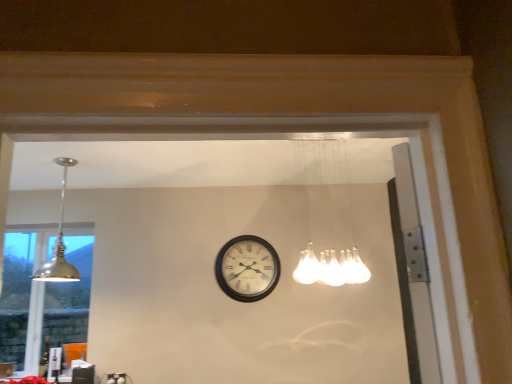
You are a GUI agent. You are given a task and a screenshot of the screen. Output one action in this format:
    pyautogui.click(x=<x>, y=<y>)
    Task: Click on the matte silver pendant light at upper left, placed as the second lamp when sorted from right to left
    The image size is (512, 384).
    Given the screenshot: What is the action you would take?
    pyautogui.click(x=59, y=243)

What do you see at coordinates (328, 214) in the screenshot? Image resolution: width=512 pixels, height=384 pixels. I see `white frosted glass light fixture at upper center, which appears as the 2th lamp when viewed from the left` at bounding box center [328, 214].

What is the approximate width of matte silver lampshade at left?

It is 3.69 inches.

What do you see at coordinates (247, 268) in the screenshot?
I see `black wooden clock at center` at bounding box center [247, 268].

Find the location of a particular element. matte silver pendant light at upper left, placed as the second lamp when sorted from right to left is located at coordinates [x=59, y=243].

From the image's perspective, is black wooden clock at center beneath matte silver lampshade at left?

No, from the image's perspective, black wooden clock at center is not below matte silver lampshade at left.

Would you say black wooden clock at center is to the left or to the right of matte silver lampshade at left in the picture?

From the image, it's evident that black wooden clock at center is to the right of matte silver lampshade at left.

Which of these two, black wooden clock at center or matte silver lampshade at left, is thinner?

matte silver lampshade at left is thinner.

In the scene shown: Is black wooden clock at center not close to matte silver lampshade at left?

Yes, black wooden clock at center and matte silver lampshade at left are quite far apart.

Is matte silver pendant light at upper left, the 1th lamp viewed from the left, completely or partially outside of black wooden clock at center?

matte silver pendant light at upper left, the 1th lamp viewed from the left, is positioned outside black wooden clock at center.

Does matte silver pendant light at upper left, placed as the second lamp when sorted from right to left, appear on the left side of black wooden clock at center?

Yes.

Can you tell me how much matte silver pendant light at upper left, placed as the second lamp when sorted from right to left, and black wooden clock at center differ in facing direction?

The angle between the facing direction of matte silver pendant light at upper left, placed as the second lamp when sorted from right to left, and the facing direction of black wooden clock at center is 90.3 degrees.

Are matte silver pendant light at upper left, placed as the second lamp when sorted from right to left, and black wooden clock at center making contact?

There is a gap between matte silver pendant light at upper left, placed as the second lamp when sorted from right to left, and black wooden clock at center.

Is black wooden clock at center thinner than matte silver pendant light at upper left, the 1th lamp viewed from the left?

Yes.

Can you confirm if black wooden clock at center is shorter than matte silver pendant light at upper left, placed as the second lamp when sorted from right to left?

Yes, black wooden clock at center is shorter than matte silver pendant light at upper left, placed as the second lamp when sorted from right to left.

Does black wooden clock at center turn towards matte silver pendant light at upper left, placed as the second lamp when sorted from right to left?

No, black wooden clock at center is not turned towards matte silver pendant light at upper left, placed as the second lamp when sorted from right to left.

Between black wooden clock at center and matte silver pendant light at upper left, the 1th lamp viewed from the left, which one appears on the right side from the viewer's perspective?

From the viewer's perspective, black wooden clock at center appears more on the right side.

From the image's perspective, is black wooden clock at center under white frosted glass light fixture at upper center, which appears as the 2th lamp when viewed from the left?

Yes, from the image's perspective, black wooden clock at center is below white frosted glass light fixture at upper center, which appears as the 2th lamp when viewed from the left.

Based on the photo, how many degrees apart are the facing directions of black wooden clock at center and white frosted glass light fixture at upper center, arranged as the 1th lamp when viewed from the right?

They differ by 90.3 degrees in their facing directions.

Considering the relative positions of black wooden clock at center and white frosted glass light fixture at upper center, which appears as the 2th lamp when viewed from the left, in the image provided, is black wooden clock at center to the left or to the right of white frosted glass light fixture at upper center, which appears as the 2th lamp when viewed from the left,?

From the image, it's evident that black wooden clock at center is to the left of white frosted glass light fixture at upper center, which appears as the 2th lamp when viewed from the left.

Could white frosted glass light fixture at upper center, which appears as the 2th lamp when viewed from the left, be considered to be inside black wooden clock at center?

No, white frosted glass light fixture at upper center, which appears as the 2th lamp when viewed from the left, is not a part of black wooden clock at center.

Does matte silver pendant light at upper left, the 1th lamp viewed from the left, have a smaller size compared to matte silver lampshade at left?

No, matte silver pendant light at upper left, the 1th lamp viewed from the left, is not smaller than matte silver lampshade at left.

Is matte silver pendant light at upper left, the 1th lamp viewed from the left, not close to matte silver lampshade at left?

No, matte silver pendant light at upper left, the 1th lamp viewed from the left, is not far from matte silver lampshade at left.

From a real-world perspective, which is physically above, matte silver pendant light at upper left, the 1th lamp viewed from the left, or matte silver lampshade at left?

In real-world perspective, matte silver pendant light at upper left, the 1th lamp viewed from the left, is above.

From a real-world perspective, who is located lower, matte silver lampshade at left or matte silver pendant light at upper left, the 1th lamp viewed from the left?

matte silver lampshade at left is physically lower.

Does point (14, 328) appear closer or farther from the camera than point (63, 180)?

Point (14, 328).

Are matte silver lampshade at left and matte silver pendant light at upper left, the 1th lamp viewed from the left, beside each other?

No.

Can you confirm if matte silver lampshade at left is smaller than matte silver pendant light at upper left, the 1th lamp viewed from the left?

Yes, matte silver lampshade at left is smaller than matte silver pendant light at upper left, the 1th lamp viewed from the left.

Does point (329, 175) appear closer or farther from the camera than point (72, 162)?

Point (329, 175) appears to be farther away from the viewer than point (72, 162).

From the image's perspective, relative to matte silver pendant light at upper left, the 1th lamp viewed from the left, is white frosted glass light fixture at upper center, which appears as the 2th lamp when viewed from the left, above or below?

Clearly, from the image's perspective, white frosted glass light fixture at upper center, which appears as the 2th lamp when viewed from the left, is above matte silver pendant light at upper left, the 1th lamp viewed from the left.

Is white frosted glass light fixture at upper center, which appears as the 2th lamp when viewed from the left, to the left or to the right of matte silver pendant light at upper left, placed as the second lamp when sorted from right to left, in the image?

white frosted glass light fixture at upper center, which appears as the 2th lamp when viewed from the left, is positioned on matte silver pendant light at upper left, placed as the second lamp when sorted from right to left,'s right side.

Does white frosted glass light fixture at upper center, which appears as the 2th lamp when viewed from the left, have a smaller size compared to matte silver pendant light at upper left, the 1th lamp viewed from the left?

Actually, white frosted glass light fixture at upper center, which appears as the 2th lamp when viewed from the left, might be larger than matte silver pendant light at upper left, the 1th lamp viewed from the left.

The width and height of the screenshot is (512, 384). What are the coordinates of `window below the black wooden clock at center (from a real-world perspective)` in the screenshot? It's located at (42, 294).

Image resolution: width=512 pixels, height=384 pixels. What are the coordinates of `wall clock below the matte silver pendant light at upper left, the 1th lamp viewed from the left (from the image's perspective)` in the screenshot? It's located at (247, 268).

Estimate the real-world distances between objects in this image. Which object is further from black wooden clock at center, matte silver lampshade at left or white frosted glass light fixture at upper center, arranged as the 1th lamp when viewed from the right?

Based on the image, matte silver lampshade at left appears to be further to black wooden clock at center.

Estimate the real-world distances between objects in this image. Which object is closer to matte silver lampshade at left, white frosted glass light fixture at upper center, arranged as the 1th lamp when viewed from the right, or matte silver pendant light at upper left, the 1th lamp viewed from the left?

matte silver pendant light at upper left, the 1th lamp viewed from the left, is closer to matte silver lampshade at left.

From the image, which object appears to be farther from black wooden clock at center, white frosted glass light fixture at upper center, which appears as the 2th lamp when viewed from the left, or matte silver pendant light at upper left, placed as the second lamp when sorted from right to left?

matte silver pendant light at upper left, placed as the second lamp when sorted from right to left, is further to black wooden clock at center.

Which object lies nearer to the anchor point black wooden clock at center, white frosted glass light fixture at upper center, arranged as the 1th lamp when viewed from the right, or matte silver lampshade at left?

Based on the image, white frosted glass light fixture at upper center, arranged as the 1th lamp when viewed from the right, appears to be nearer to black wooden clock at center.

Which object lies nearer to the anchor point matte silver pendant light at upper left, placed as the second lamp when sorted from right to left, matte silver lampshade at left or white frosted glass light fixture at upper center, arranged as the 1th lamp when viewed from the right?

The object closer to matte silver pendant light at upper left, placed as the second lamp when sorted from right to left, is matte silver lampshade at left.

Considering their positions, is matte silver lampshade at left positioned further to matte silver pendant light at upper left, the 1th lamp viewed from the left, than black wooden clock at center?

Based on the image, black wooden clock at center appears to be further to matte silver pendant light at upper left, the 1th lamp viewed from the left.

Which object lies nearer to the anchor point white frosted glass light fixture at upper center, which appears as the 2th lamp when viewed from the left, matte silver lampshade at left or matte silver pendant light at upper left, placed as the second lamp when sorted from right to left?

matte silver pendant light at upper left, placed as the second lamp when sorted from right to left, is positioned closer to the anchor white frosted glass light fixture at upper center, which appears as the 2th lamp when viewed from the left.

When comparing their distances from white frosted glass light fixture at upper center, which appears as the 2th lamp when viewed from the left, does matte silver lampshade at left or black wooden clock at center seem further?

The object further to white frosted glass light fixture at upper center, which appears as the 2th lamp when viewed from the left, is matte silver lampshade at left.

The width and height of the screenshot is (512, 384). I want to click on lamp situated between matte silver lampshade at left and white frosted glass light fixture at upper center, which appears as the 2th lamp when viewed from the left, from left to right, so click(59, 243).

At what (x,y) coordinates should I click in order to perform the action: click on wall clock between matte silver lampshade at left and white frosted glass light fixture at upper center, which appears as the 2th lamp when viewed from the left, from left to right. Please return your answer as a coordinate pair (x, y). Looking at the image, I should click on (247, 268).

Image resolution: width=512 pixels, height=384 pixels. In order to click on wall clock between matte silver pendant light at upper left, placed as the second lamp when sorted from right to left, and white frosted glass light fixture at upper center, which appears as the 2th lamp when viewed from the left, in the horizontal direction in this screenshot , I will do `click(247, 268)`.

The width and height of the screenshot is (512, 384). Find the location of `lamp between matte silver lampshade at left and black wooden clock at center in the horizontal direction`. lamp between matte silver lampshade at left and black wooden clock at center in the horizontal direction is located at coordinates (59, 243).